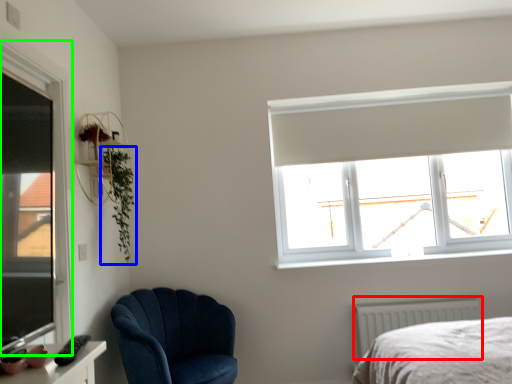
Question: Which is farther away from radiator (highlighted by a red box)? plant (highlighted by a blue box) or window (highlighted by a green box)?

Choices:
 (A) plant
 (B) window

Answer: (B)